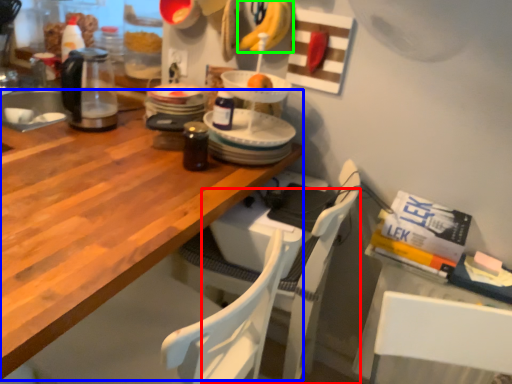
Question: Which object is positioned closest to chair (highlighted by a red box)? Select from desk (highlighted by a blue box) and banana (highlighted by a green box).

Choices:
 (A) desk
 (B) banana

Answer: (A)